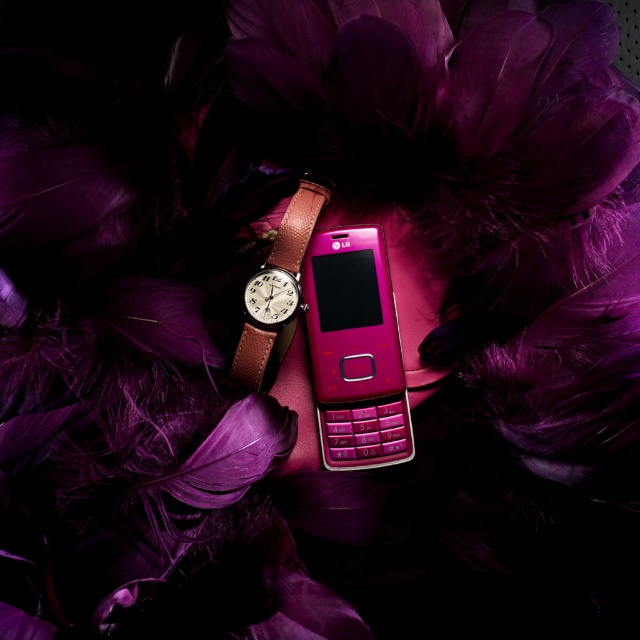
Is pink glossy phone at center to the right of leather strap at center from the viewer's perspective?

Correct, you'll find pink glossy phone at center to the right of leather strap at center.

Who is more distant from viewer, (372, 380) or (246, 380)?

The point (372, 380) is behind.

Is point (317, 358) positioned behind point (305, 241)?

Yes, it is behind point (305, 241).

Locate an element on the screen. This screenshot has width=640, height=640. pink glossy phone at center is located at coordinates (355, 349).